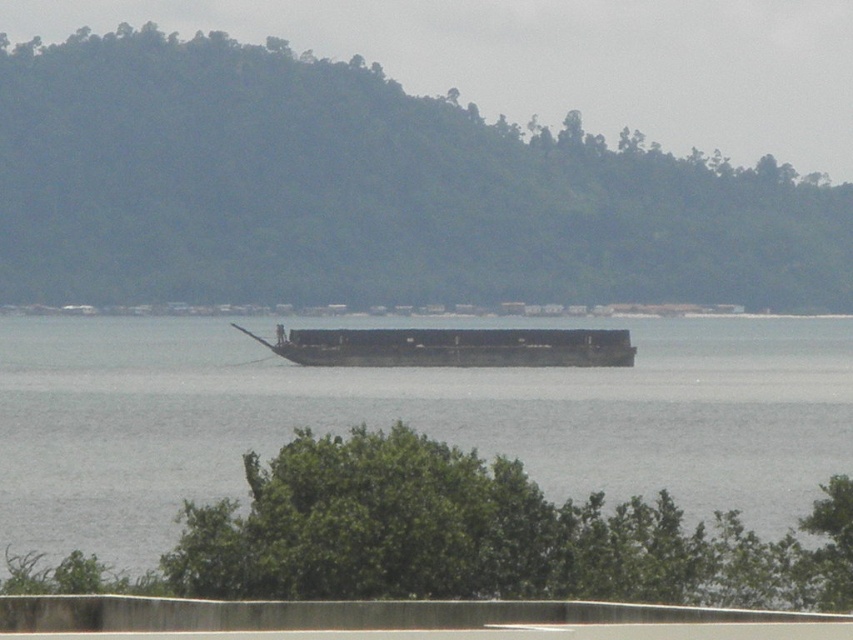
Where is `brown wooden boat at center`? brown wooden boat at center is located at coordinates (408, 419).

Who is more forward, (x=605, y=483) or (x=585, y=353)?

Point (x=605, y=483) is in front.

You are a GUI agent. You are given a task and a screenshot of the screen. Output one action in this format:
    pyautogui.click(x=<x>, y=<y>)
    Task: Click on the brown wooden boat at center
    This screenshot has height=640, width=853.
    Given the screenshot: What is the action you would take?
    pyautogui.click(x=408, y=419)

Is point (703, 285) positioned in front of point (764, 412)?

No.

The height and width of the screenshot is (640, 853). I want to click on green forested hill at center, so pos(366,192).

Does green forested hill at center have a lesser height compared to dark gray metallic barge at center?

Incorrect, green forested hill at center's height does not fall short of dark gray metallic barge at center's.

Between green forested hill at center and dark gray metallic barge at center, which one appears on the right side from the viewer's perspective?

green forested hill at center

Between point (172, 202) and point (421, 349), which one is positioned behind?

The point (172, 202) is behind.

Image resolution: width=853 pixels, height=640 pixels. In order to click on green forested hill at center in this screenshot , I will do `click(366, 192)`.